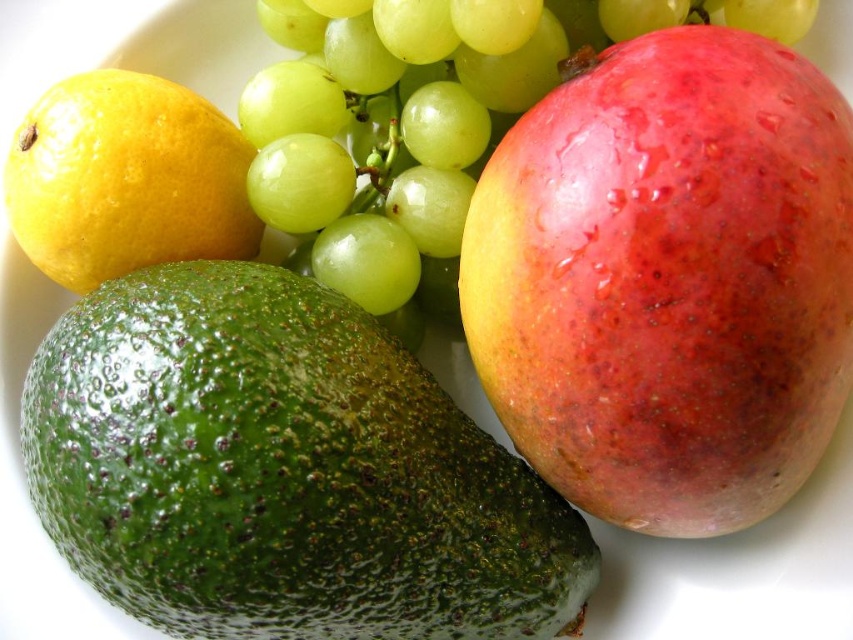
You are arranging fruits on a table and want to place the green matte grape at upper center and the yellow matte lemon at upper left. If you want to see both fruits clearly, which one should you move forward to ensure they are both visible?

The yellow matte lemon at upper left should be moved forward so that both the green matte grape at upper center and the yellow matte lemon at upper left are visible, as currently the green matte grape at upper center is blocking the view of the yellow matte lemon at upper left.

You are trying to pick up the green rough avocado at lower left and the green matte grape at upper center. Which fruit is easier to grab without moving your hand much?

The green rough avocado at lower left is easier to grab because it is closer to the viewer than the green matte grape at upper center.

In the scene shown: You are a food photographer setting up a still life with fruits. You have a green matte grape at upper center. Where exactly should you place your camera to capture the fruit in the center of the frame?

To capture the green matte grape at upper center in the center of the frame, position your camera directly at the coordinates corresponding to point 0.163 on the horizontal axis and 0.499 on the vertical axis relative to the image plane.